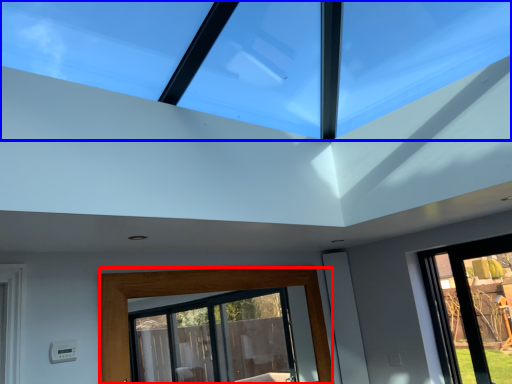
Question: Which object is further to the camera taking this photo, window (highlighted by a red box) or window (highlighted by a blue box)?

Choices:
 (A) window
 (B) window

Answer: (A)